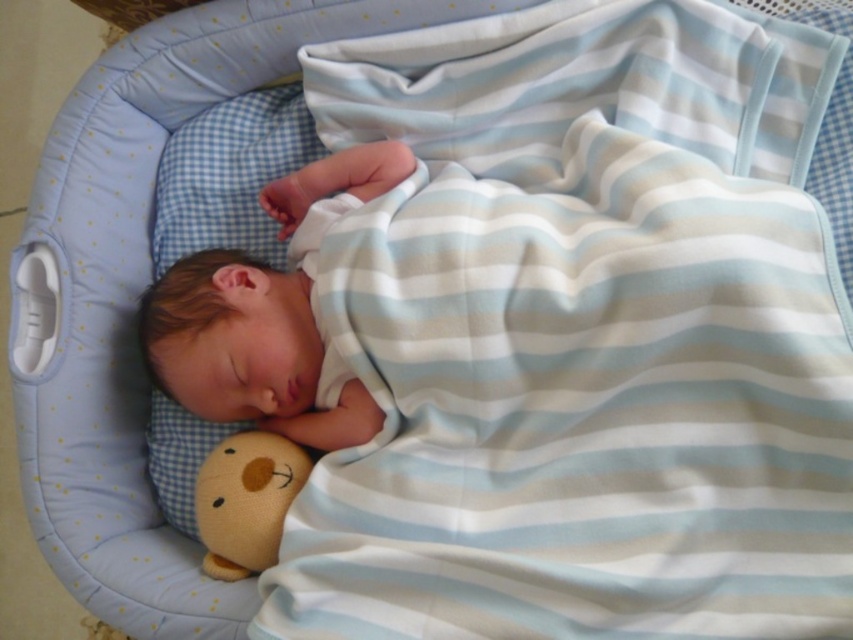
Question: Can you confirm if white soft newborn at center is thinner than soft yellow plush bear at lower left?

Choices:
 (A) no
 (B) yes

Answer: (A)

Question: Is white soft newborn at center smaller than soft yellow plush bear at lower left?

Choices:
 (A) no
 (B) yes

Answer: (A)

Question: Which point is farther to the camera?

Choices:
 (A) soft yellow plush bear at lower left
 (B) white soft newborn at center

Answer: (B)

Question: Which object appears farthest from the camera in this image?

Choices:
 (A) white soft newborn at center
 (B) soft yellow plush bear at lower left

Answer: (A)

Question: Does white soft newborn at center lie in front of soft yellow plush bear at lower left?

Choices:
 (A) no
 (B) yes

Answer: (A)